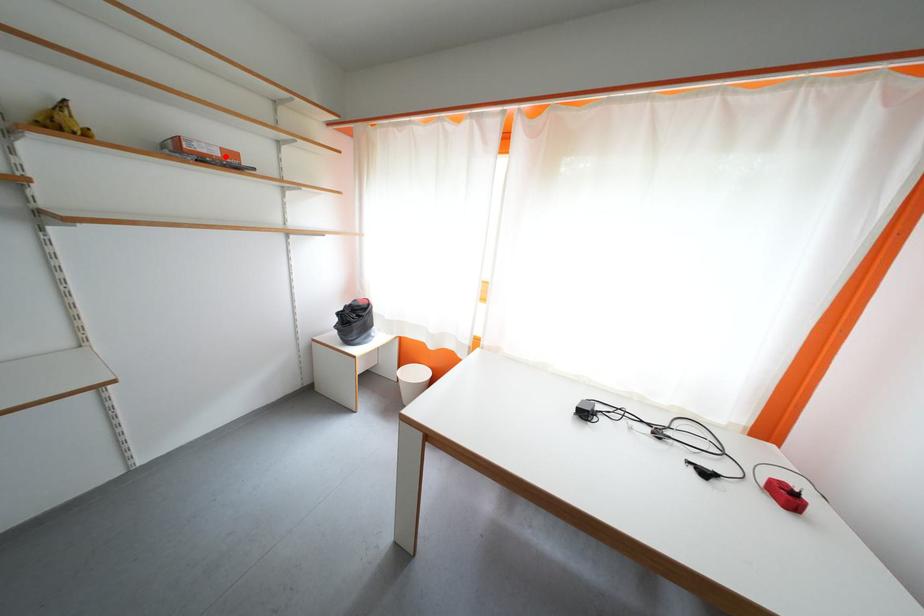
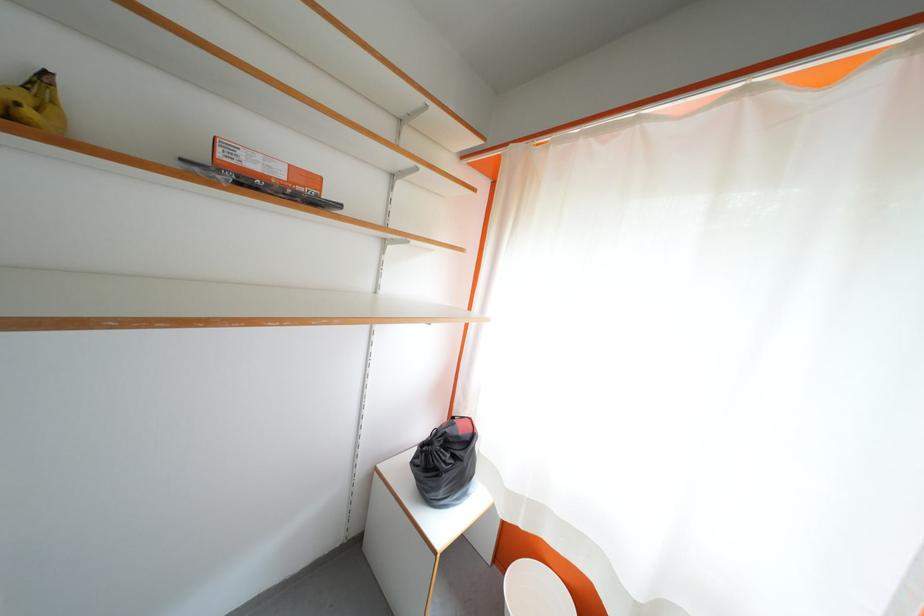
The point at the highlighted location is marked in the first image. Where is the corresponding point in the second image?

(289, 177)